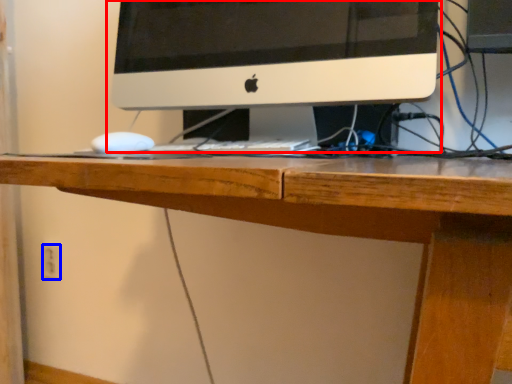
Question: Which of the following is the farthest to the observer, computer monitor (highlighted by a red box) or electric outlet (highlighted by a blue box)?

Choices:
 (A) computer monitor
 (B) electric outlet

Answer: (B)